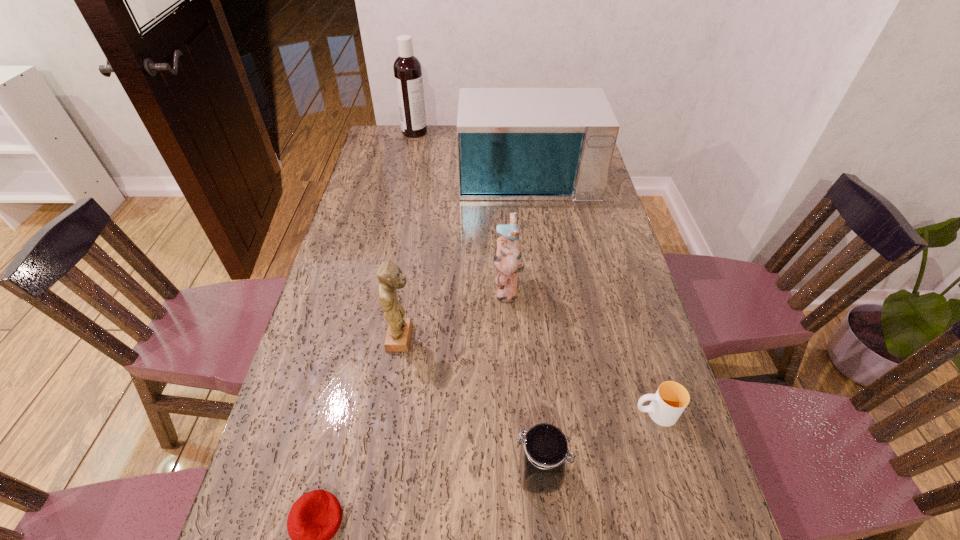
Locate an element on the screen. This screenshot has width=960, height=540. free space located with the handle on the side of the second shortest object is located at coordinates (536, 413).

Find the location of a particular element. The image size is (960, 540). blank area located with the handle on the side of the second shortest object is located at coordinates (461, 413).

What are the coordinates of `dishwasher detergent present at the far edge` in the screenshot? It's located at (407, 68).

The image size is (960, 540). Identify the location of microwave oven situated at the far edge. (514, 144).

Identify the location of object that is at the left edge. Image resolution: width=960 pixels, height=540 pixels. (407, 68).

What are the coordinates of `microwave oven present at the right edge` in the screenshot? It's located at (514, 144).

Image resolution: width=960 pixels, height=540 pixels. I want to click on cup that is at the right edge, so click(x=670, y=400).

Locate an element on the screen. object positioned at the far left corner is located at coordinates point(407,68).

You are a GUI agent. You are given a task and a screenshot of the screen. Output one action in this format:
    pyautogui.click(x=<x>, y=<y>)
    Task: Click on the object that is at the far right corner
    This screenshot has height=540, width=960.
    Given the screenshot: What is the action you would take?
    pyautogui.click(x=514, y=144)

Image resolution: width=960 pixels, height=540 pixels. I want to click on blank space at the far edge, so click(445, 140).